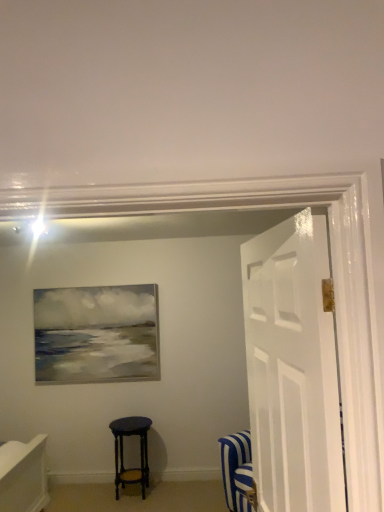
Question: Is matte black stool at center to the left or to the right of white glossy door at right in the image?

Choices:
 (A) right
 (B) left

Answer: (B)

Question: From the image's perspective, relative to white glossy door at right, is matte black stool at center above or below?

Choices:
 (A) below
 (B) above

Answer: (A)

Question: Considering the positions of matte black stool at center and white glossy door at right in the image, is matte black stool at center bigger or smaller than white glossy door at right?

Choices:
 (A) big
 (B) small

Answer: (B)

Question: Is white glossy door at right wider or thinner than matte black stool at center?

Choices:
 (A) thin
 (B) wide

Answer: (A)

Question: Considering the positions of white glossy door at right and matte black stool at center in the image, is white glossy door at right bigger or smaller than matte black stool at center?

Choices:
 (A) big
 (B) small

Answer: (A)

Question: In the image, is white glossy door at right positioned in front of or behind matte black stool at center?

Choices:
 (A) behind
 (B) front

Answer: (B)

Question: Considering the positions of point (332, 380) and point (125, 476), is point (332, 380) closer or farther from the camera than point (125, 476)?

Choices:
 (A) farther
 (B) closer

Answer: (B)